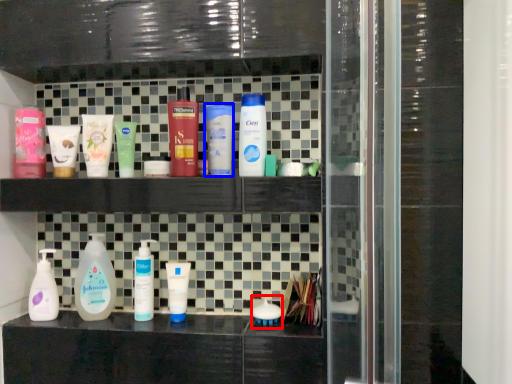
Question: Which of the following is the farthest to the observer, toiletry (highlighted by a red box) or toiletry (highlighted by a blue box)?

Choices:
 (A) toiletry
 (B) toiletry

Answer: (A)